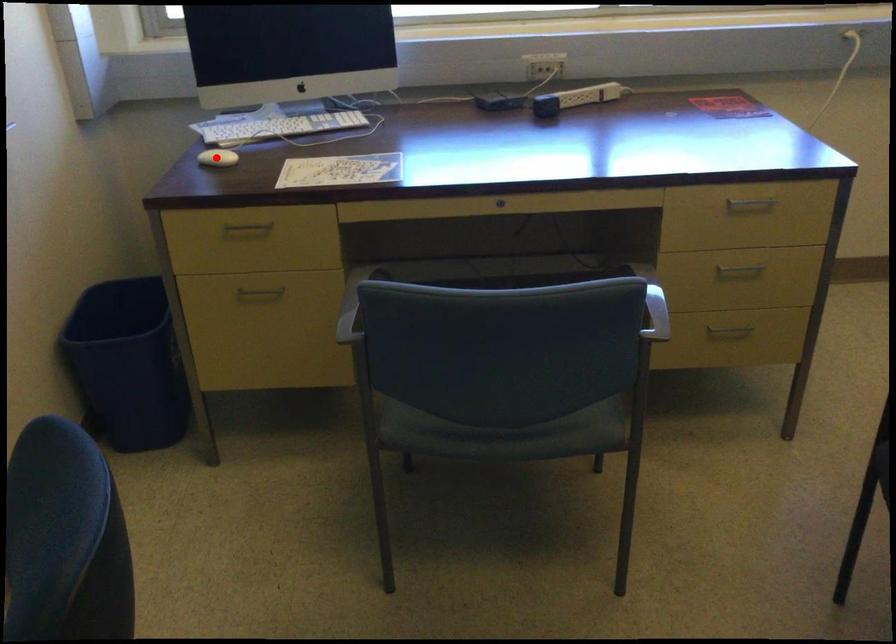
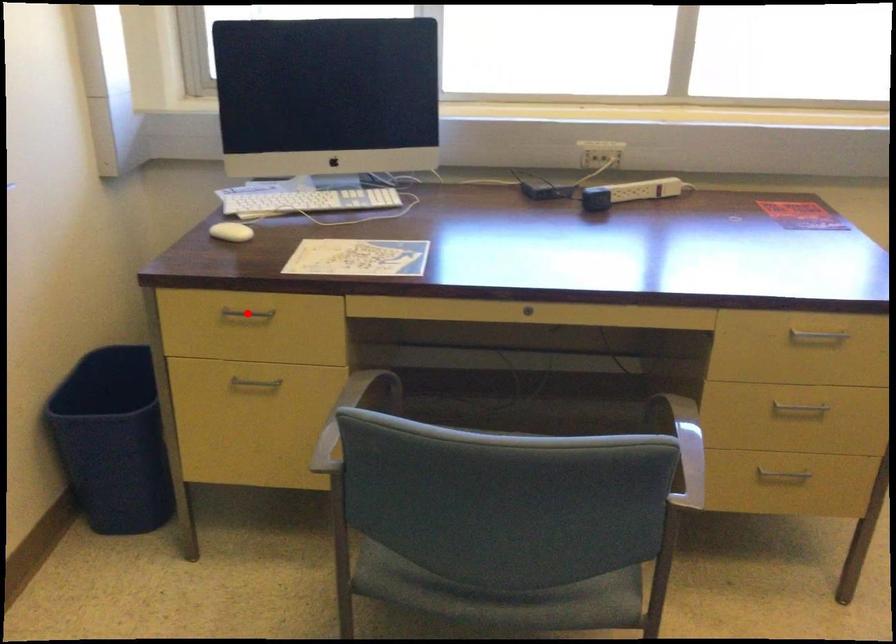
I am providing you with two images of the same scene from different viewpoints. A red point is marked on the first image and another point is marked on the second image. Is the marked point in image1 the same physical position as the marked point in image2?

No